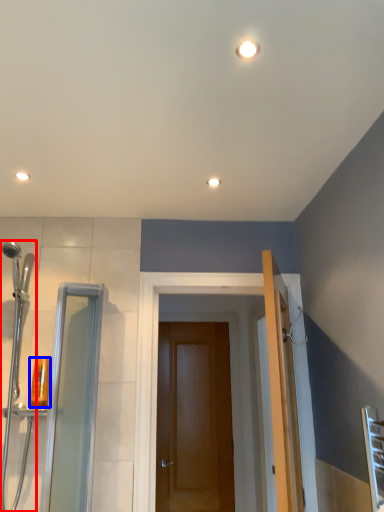
Question: Which point is closer to the camera, shower door (highlighted by a red box) or toiletry (highlighted by a blue box)?

Choices:
 (A) shower door
 (B) toiletry

Answer: (A)